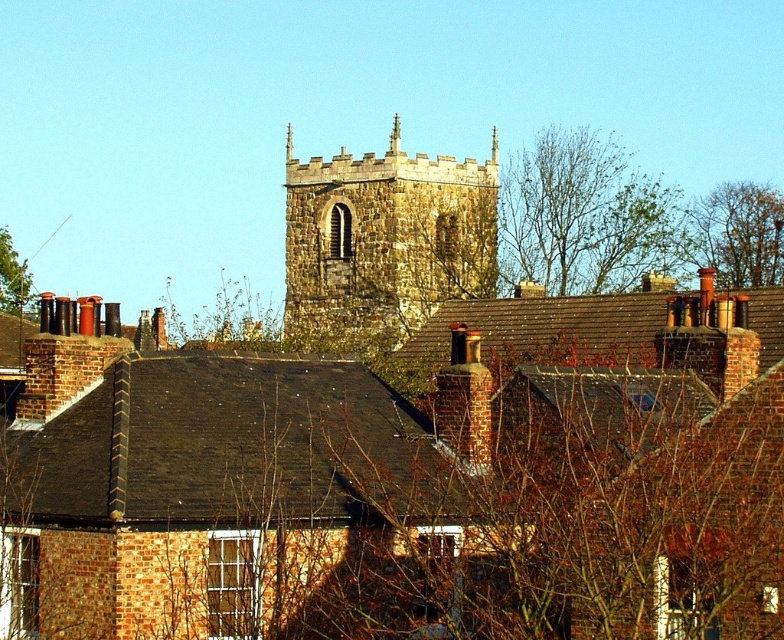
Question: Can you confirm if stone steeple at center is wider than brown leafy tree at upper right?

Choices:
 (A) no
 (B) yes

Answer: (B)

Question: Considering the real-world distances, which object is farthest from the brown leafy tree at upper right?

Choices:
 (A) bare branches at upper center
 (B) green leafy tree at upper left

Answer: (B)

Question: Does brown leafy tree at upper right have a smaller size compared to green leafy tree at upper left?

Choices:
 (A) yes
 (B) no

Answer: (B)

Question: Is stone steeple at center smaller than brown leafy tree at upper right?

Choices:
 (A) no
 (B) yes

Answer: (A)

Question: Which point appears farthest from the camera in this image?

Choices:
 (A) (550, 198)
 (B) (764, 188)
 (C) (298, 163)

Answer: (B)

Question: Which object appears farthest from the camera in this image?

Choices:
 (A) green leafy tree at upper left
 (B) brown leafy tree at upper right
 (C) bare branches at upper center

Answer: (A)